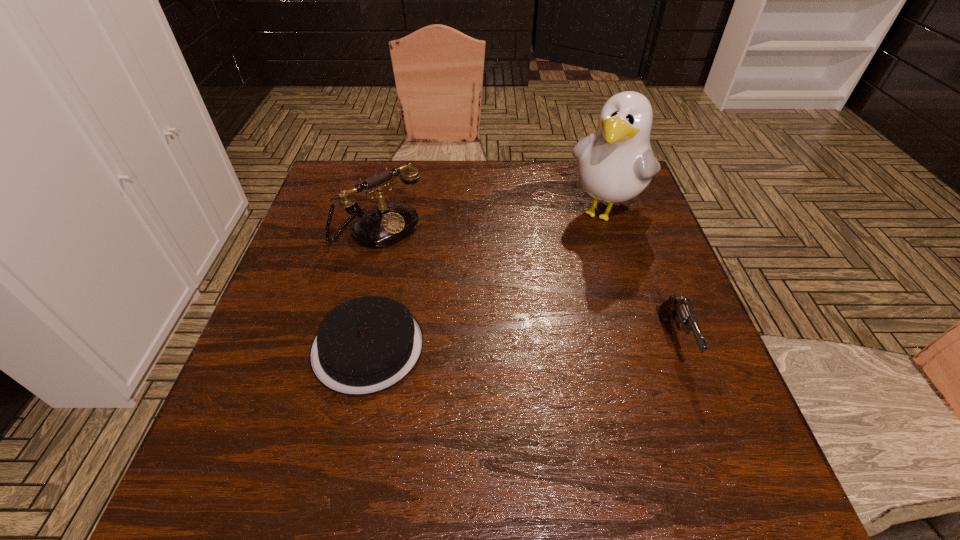
Where is `free location at the far edge of the desktop`? The height and width of the screenshot is (540, 960). free location at the far edge of the desktop is located at coordinates (490, 205).

At what (x,y) coordinates should I click in order to perform the action: click on free location at the near edge. Please return your answer as a coordinate pair (x, y). Looking at the image, I should click on (450, 396).

The width and height of the screenshot is (960, 540). I want to click on free space at the left edge of the desktop, so click(285, 298).

The width and height of the screenshot is (960, 540). In the image, there is a desktop. What are the coordinates of `blank space at the right edge` in the screenshot? It's located at (603, 220).

The width and height of the screenshot is (960, 540). I want to click on vacant space at the far left corner of the desktop, so click(x=348, y=184).

This screenshot has height=540, width=960. In order to click on free space at the far right corner in this screenshot , I will do `click(604, 205)`.

The height and width of the screenshot is (540, 960). In order to click on free space between the tallest object and the shortest object in this screenshot , I will do `click(487, 279)`.

Locate an element on the screen. This screenshot has width=960, height=540. vacant area between the telephone and the second shortest object is located at coordinates (527, 285).

I want to click on empty space that is in between the shortest object and the second tallest object, so click(x=373, y=288).

This screenshot has height=540, width=960. Identify the location of empty location between the tallest object and the second tallest object. (492, 220).